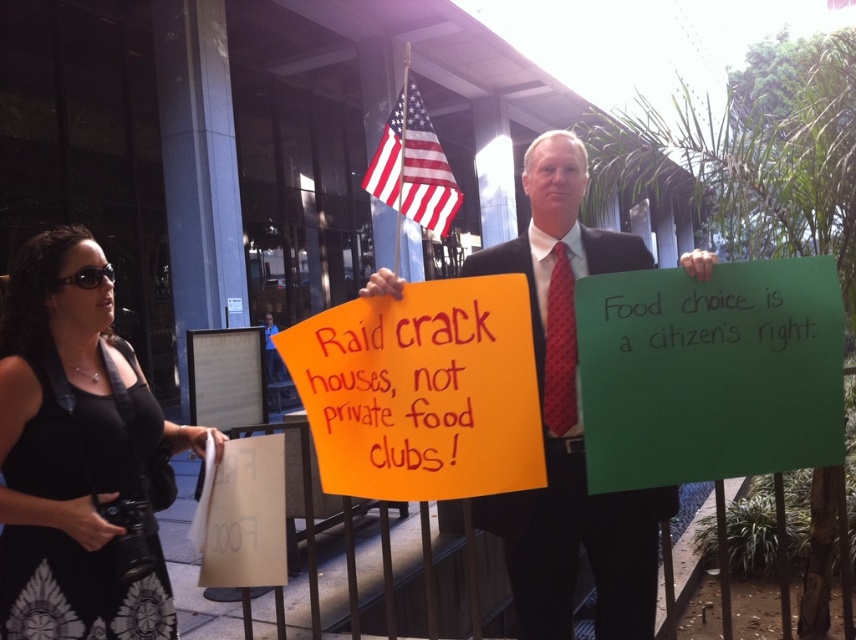
Question: Where is green paper sign at center located in relation to red/white/blue fabric flag at center in the image?

Choices:
 (A) right
 (B) left

Answer: (A)

Question: Is green paper sign at center to the left of black dress at left from the viewer's perspective?

Choices:
 (A) yes
 (B) no

Answer: (B)

Question: Which object is closer to the camera taking this photo?

Choices:
 (A) matte orange sign at center
 (B) orange paper sign at center

Answer: (A)

Question: Does green paper sign at center have a lesser width compared to red/white/blue fabric flag at center?

Choices:
 (A) no
 (B) yes

Answer: (A)

Question: Which point appears closest to the camera in this image?

Choices:
 (A) (563, 276)
 (B) (403, 80)
 (C) (746, 342)

Answer: (C)

Question: Among these objects, which one is farthest from the camera?

Choices:
 (A) matte orange sign at center
 (B) green paper sign at center

Answer: (B)